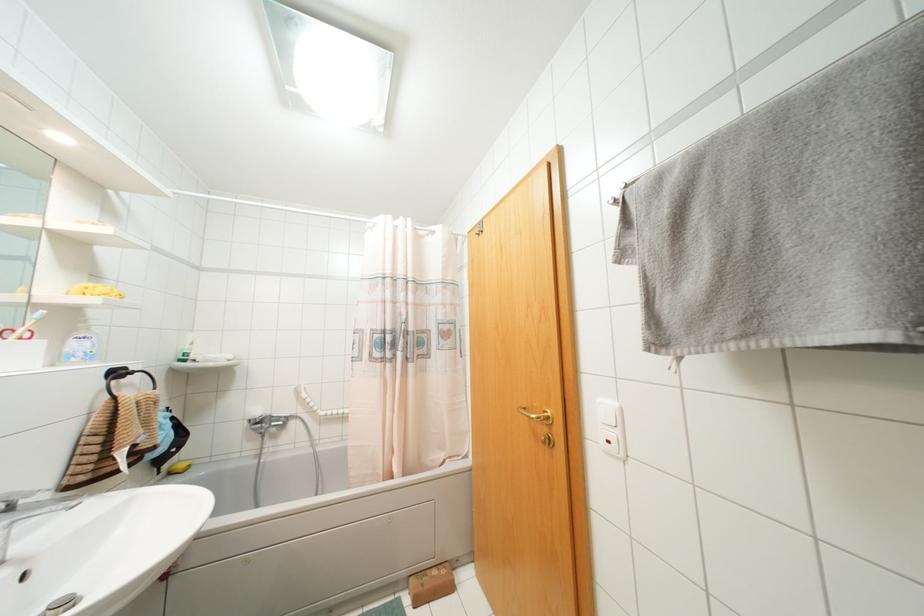
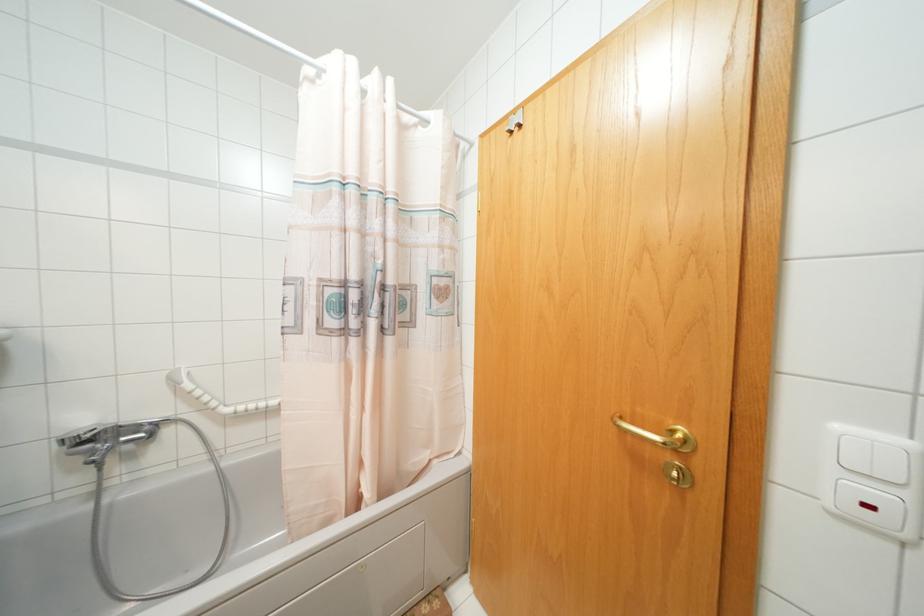
What movement of the cameraman would produce the second image?

The movement direction of the cameraman is left, forward.